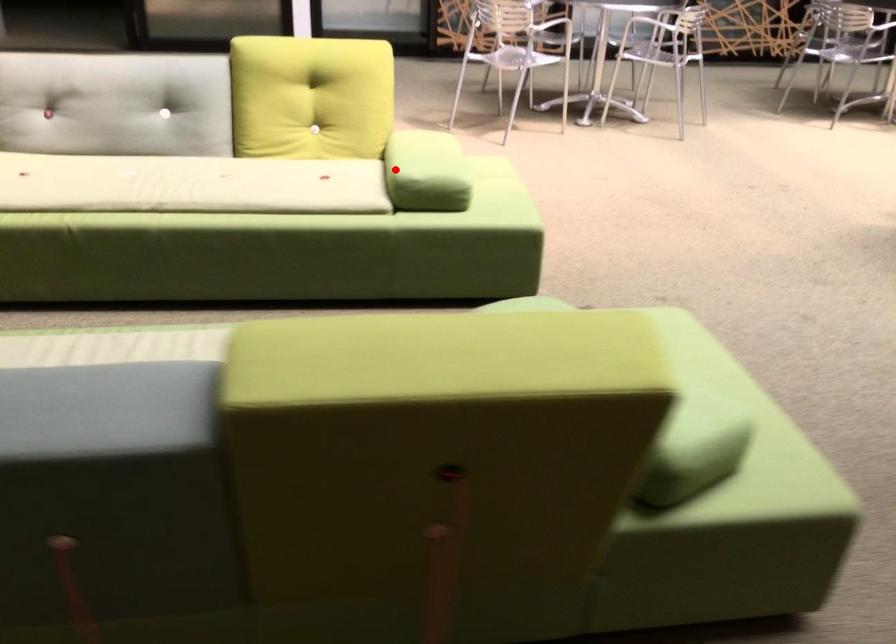
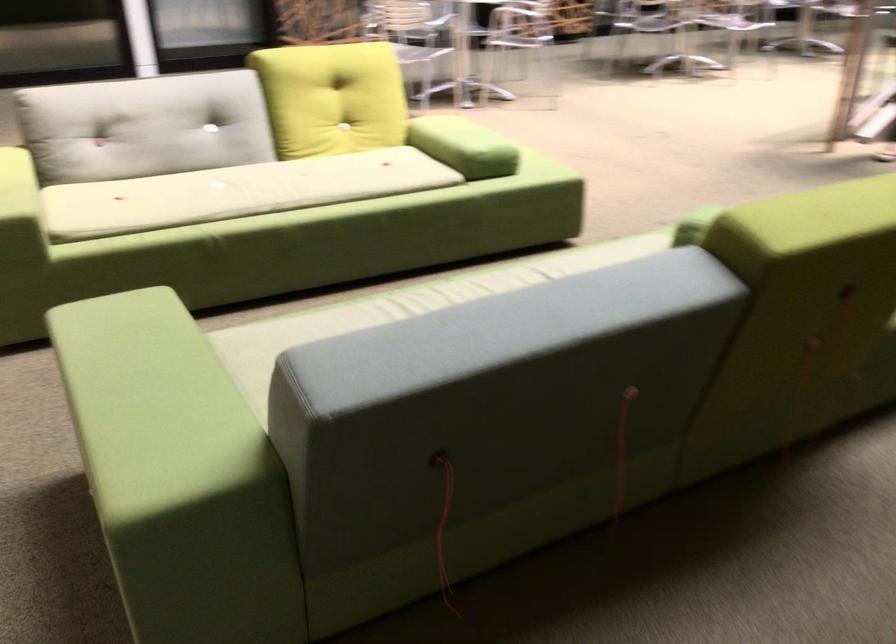
Question: I am providing you with two images of the same scene from different viewpoints. Image1 has a red point marked. In image2, the corresponding 3D location appears at what relative position? Reply with the corresponding letter.

Choices:
 (A) Closer
 (B) Farther

Answer: (B)